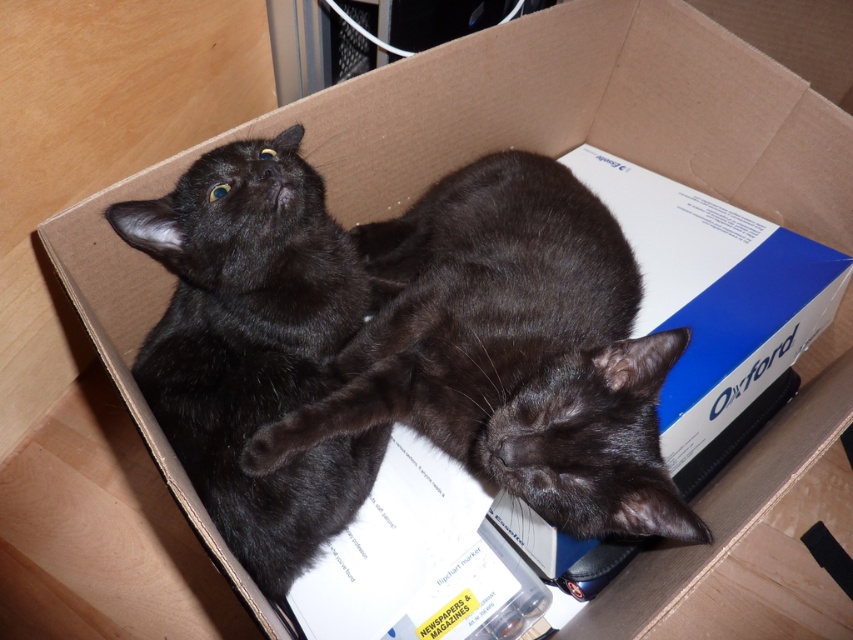
You are a cat owner who wants to place a small toy between the black fur cat at center and the black fur cat at upper left. The toy is 2 inches long. Is there enough space between them to fit the toy?

The black fur cat at center and black fur cat at upper left are 6.79 inches apart from each other. Since the toy is 2 inches long, there is sufficient space between them to fit the toy.

You are a cat owner who wants to place a new toy in the box where the black fur cat at center and the black fur cat at upper left are resting. To ensure both cats have enough space, you need to know which cat takes up more horizontal space in the box. Which cat has a greater width?

The black fur cat at center has a greater width than the black fur cat at upper left, so placing the toy away from the black fur cat at center would give both cats enough space.